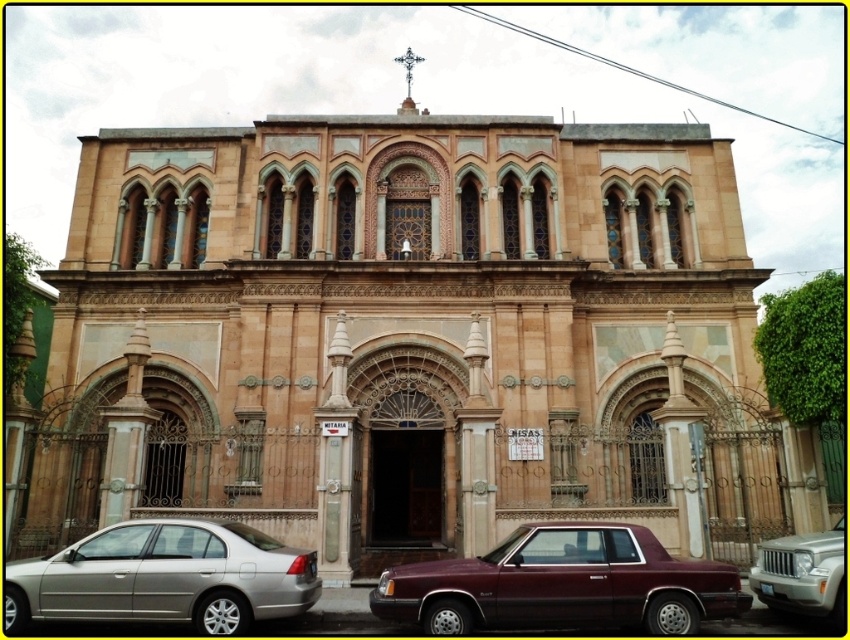
Can you confirm if maroon metallic car at center is shorter than silver metallic suv at lower right?

In fact, maroon metallic car at center may be taller than silver metallic suv at lower right.

Which is in front, point (551, 573) or point (834, 602)?

Point (834, 602) is in front.

Identify the location of maroon metallic car at center. (562, 584).

Is point (499, 624) positioned in front of point (289, 588)?

Yes, point (499, 624) is closer to viewer.

Can you confirm if maroon metallic car at center is positioned above silver metallic sedan at lower left?

No.

Locate an element on the screen. Image resolution: width=850 pixels, height=640 pixels. maroon metallic car at center is located at coordinates (562, 584).

Identify the location of maroon metallic car at center. (562, 584).

Does silver metallic sedan at lower left lie in front of silver metallic suv at lower right?

Yes.

Can you confirm if silver metallic sedan at lower left is positioned to the right of silver metallic suv at lower right?

Incorrect, silver metallic sedan at lower left is not on the right side of silver metallic suv at lower right.

Who is more distant from viewer, (199, 624) or (831, 577)?

Point (831, 577)

You are a GUI agent. You are given a task and a screenshot of the screen. Output one action in this format:
    pyautogui.click(x=<x>, y=<y>)
    Task: Click on the silver metallic sedan at lower left
    
    Given the screenshot: What is the action you would take?
    pyautogui.click(x=165, y=577)